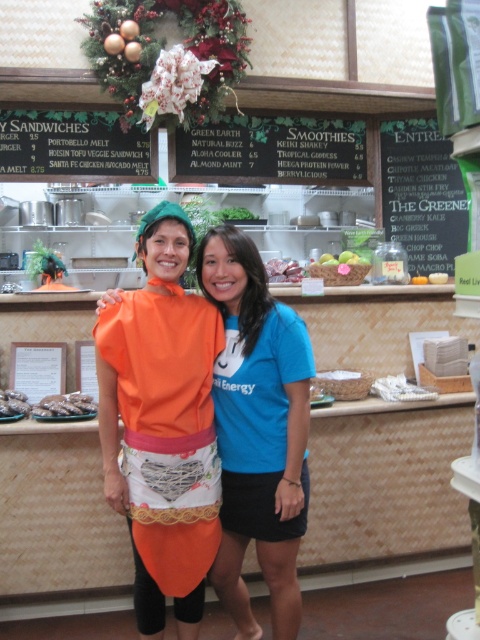
Does orange fabric apron at center have a larger size compared to green chalkboard at upper center?

Actually, orange fabric apron at center might be smaller than green chalkboard at upper center.

From the picture: Is orange fabric apron at center below green chalkboard at upper center?

Correct, orange fabric apron at center is located below green chalkboard at upper center.

Identify the location of orange fabric apron at center. The height and width of the screenshot is (640, 480). (167, 442).

What do you see at coordinates (167, 442) in the screenshot? The image size is (480, 640). I see `orange fabric apron at center` at bounding box center [167, 442].

Does orange fabric apron at center have a greater width compared to brown crumbly cookies at center?

No.

Where is `orange fabric apron at center`? orange fabric apron at center is located at coordinates (167, 442).

Find the location of a particular element. orange fabric apron at center is located at coordinates [x=167, y=442].

Between blue fabric shirt at center and brown crumbly cookies at center, which one has more height?

Result: Standing taller between the two is blue fabric shirt at center.

Based on the photo, does blue fabric shirt at center have a greater height compared to brown crumbly cookies at center?

Indeed, blue fabric shirt at center has a greater height compared to brown crumbly cookies at center.

Between point (292, 376) and point (0, 408), which one is positioned behind?

Point (0, 408)

This screenshot has width=480, height=640. I want to click on blue fabric shirt at center, so click(259, 422).